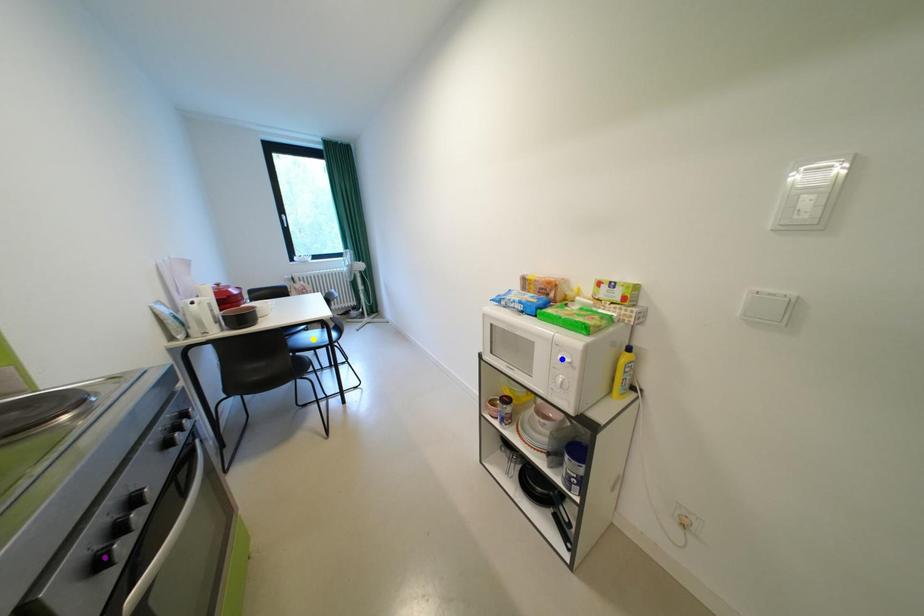
Order these from nearest to farthest:
yellow point, purple point, blue point

purple point → blue point → yellow point